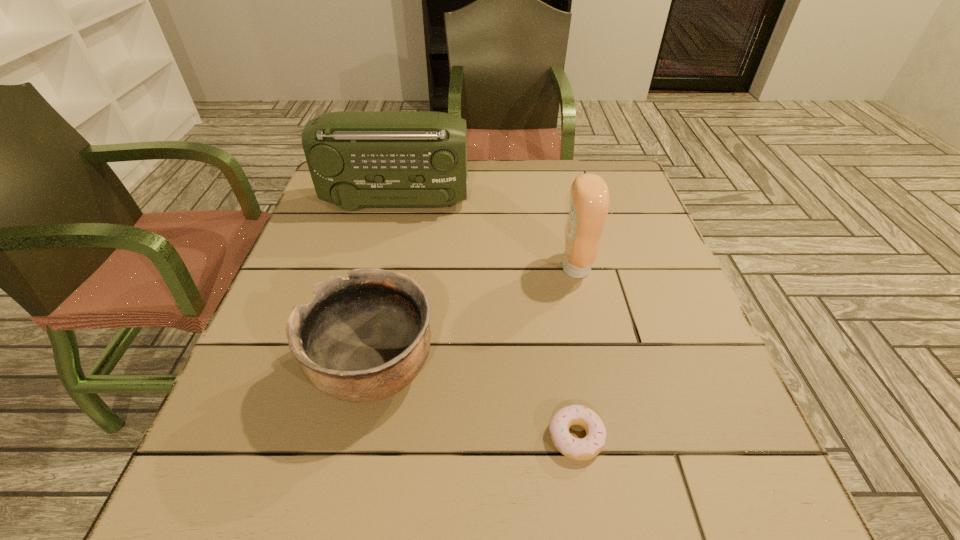
At what (x,y) coordinates should I click in order to perform the action: click on the farthest object. Please return your answer as a coordinate pair (x, y). Looking at the image, I should click on (356, 159).

This screenshot has width=960, height=540. I want to click on condiment, so click(589, 196).

Locate an element on the screen. Image resolution: width=960 pixels, height=540 pixels. pottery is located at coordinates (362, 339).

The height and width of the screenshot is (540, 960). Find the location of `doughnut`. doughnut is located at coordinates (591, 445).

This screenshot has height=540, width=960. Find the location of `vacant space located 0.160m on the front-facing side of the radio_receiver`. vacant space located 0.160m on the front-facing side of the radio_receiver is located at coordinates (527, 202).

Image resolution: width=960 pixels, height=540 pixels. Find the location of `blank area located on the label of the condiment`. blank area located on the label of the condiment is located at coordinates (422, 268).

Where is `vacant space located 0.350m on the label of the condiment`? This screenshot has width=960, height=540. vacant space located 0.350m on the label of the condiment is located at coordinates (405, 268).

Find the location of a particular element. The image size is (960, 540). free space located on the label of the condiment is located at coordinates (516, 268).

Locate an element on the screen. The image size is (960, 540). vacant space located 0.120m on the left of the third tallest object is located at coordinates (247, 369).

Where is `vacant space located on the back of the shortest object`? The width and height of the screenshot is (960, 540). vacant space located on the back of the shortest object is located at coordinates (555, 306).